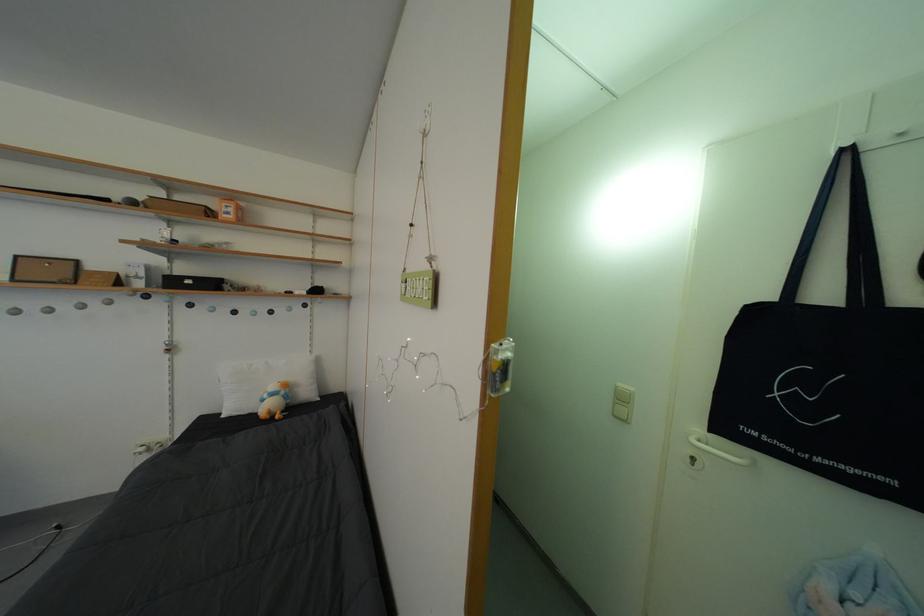
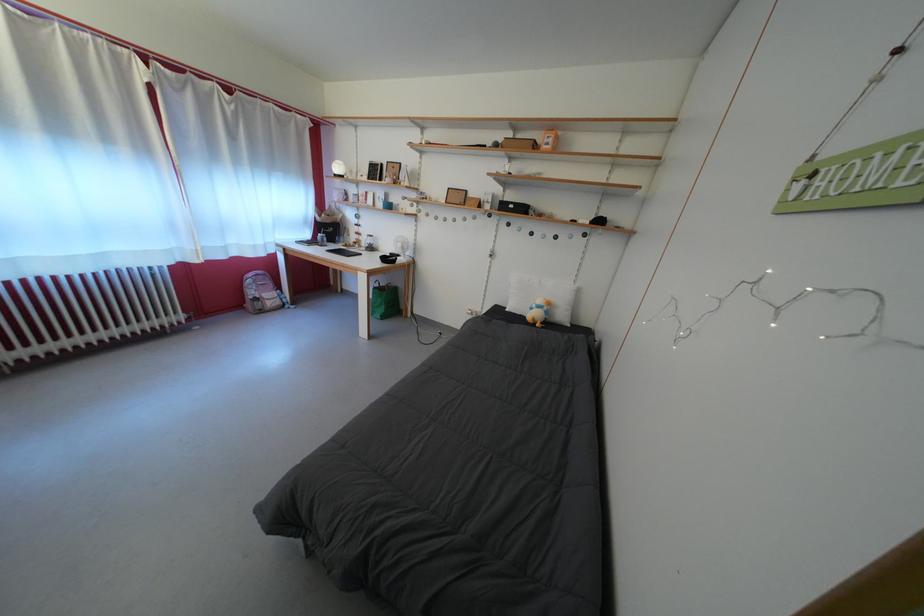
In the second image, find the point that corresponds to (215,214) in the first image.

(543, 147)